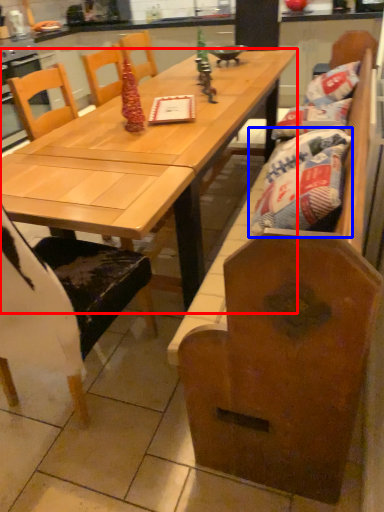
Question: Which object appears farthest to the camera in this image, table (highlighted by a red box) or material (highlighted by a blue box)?

Choices:
 (A) table
 (B) material

Answer: (B)